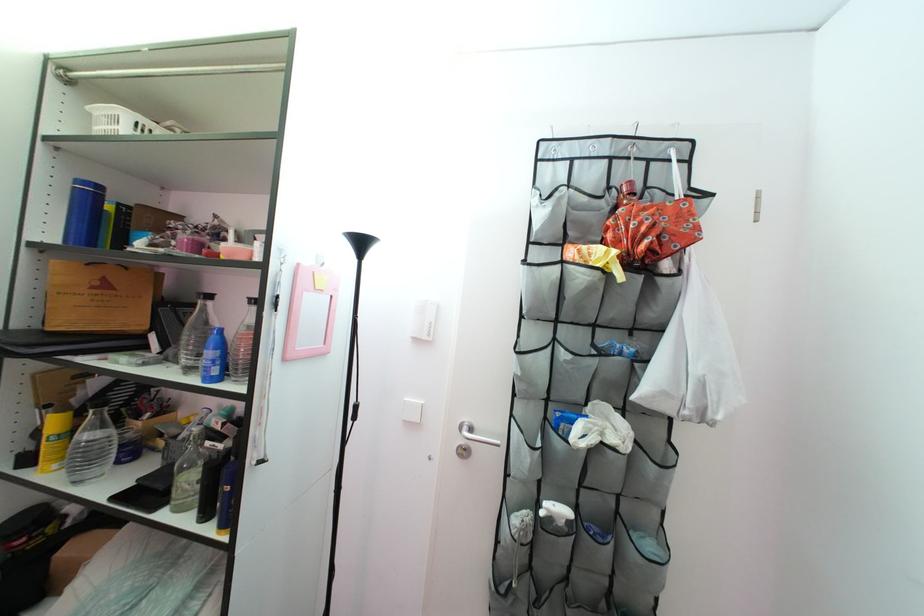
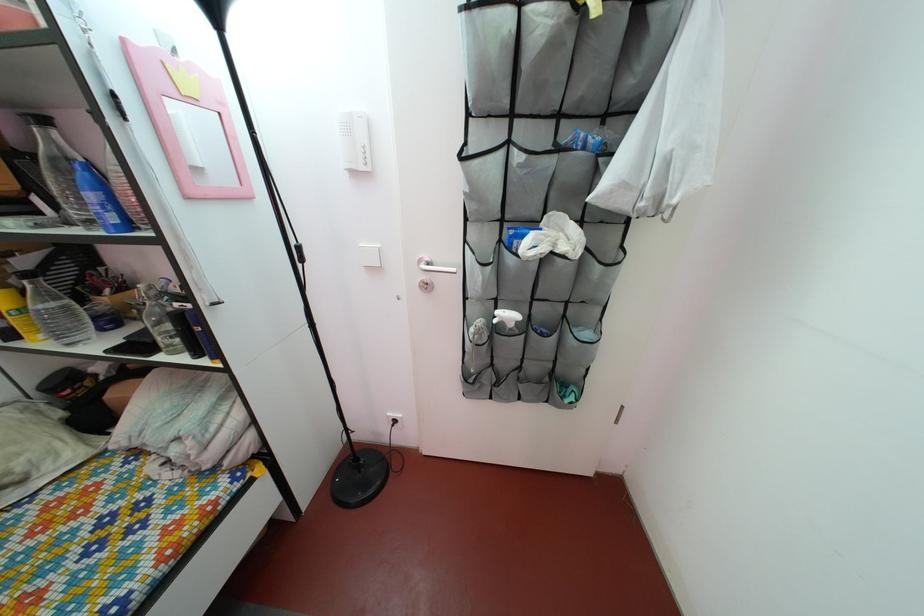
In the second image, find the point that corresponds to [106,391] in the first image.

(32, 270)